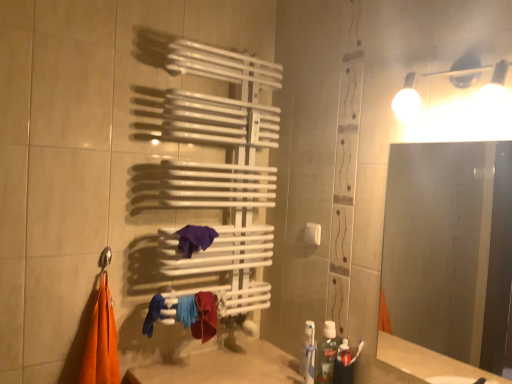
This screenshot has height=384, width=512. What do you see at coordinates (195, 238) in the screenshot?
I see `purple fabric towel at center` at bounding box center [195, 238].

This screenshot has width=512, height=384. What do you see at coordinates (313, 233) in the screenshot? I see `white plastic towel bar at center` at bounding box center [313, 233].

The height and width of the screenshot is (384, 512). What do you see at coordinates (326, 354) in the screenshot?
I see `translucent plastic toothpaste at lower right` at bounding box center [326, 354].

Where is `frosted glass mirror at right`? This screenshot has height=384, width=512. frosted glass mirror at right is located at coordinates (450, 248).

How different are the orientations of white plastic towel bar at center and frosted glass mirror at right in degrees?

They differ by 0.426 degrees in their facing directions.

Is white plastic towel bar at center positioned far away from frosted glass mirror at right?

Yes, white plastic towel bar at center is far from frosted glass mirror at right.

Who is taller, white plastic towel bar at center or frosted glass mirror at right?

Standing taller between the two is frosted glass mirror at right.

From a real-world perspective, which is physically below, white plastic towel bar at center or frosted glass mirror at right?

frosted glass mirror at right is physically lower.

Is blue fabric at lower center not close to translucent plastic toothpaste at lower right?

No, blue fabric at lower center is not far away from translucent plastic toothpaste at lower right.

Which is more to the right, blue fabric at lower center or translucent plastic toothpaste at lower right?

From the viewer's perspective, translucent plastic toothpaste at lower right appears more on the right side.

The width and height of the screenshot is (512, 384). What are the coordinates of `clothe in front of the translucent plastic toothpaste at lower right` in the screenshot? It's located at (153, 314).

Is blue fabric at lower center closer to camera compared to purple fabric towel at center?

No.

Can you confirm if blue fabric at lower center is smaller than purple fabric towel at center?

Yes.

Based on the photo, would you consider blue fabric at lower center to be distant from purple fabric towel at center?

No, blue fabric at lower center is in close proximity to purple fabric towel at center.

Is the surface of purple fabric towel at center in direct contact with white plastic towel bar at center?

There is a gap between purple fabric towel at center and white plastic towel bar at center.

Is point (189, 234) closer or farther from the camera than point (310, 224)?

Point (189, 234).

How much distance is there between purple fabric towel at center and white plastic towel bar at center?

purple fabric towel at center and white plastic towel bar at center are 16.60 inches apart from each other.

Considering the sizes of objects purple fabric towel at center and white plastic towel bar at center in the image provided, who is thinner, purple fabric towel at center or white plastic towel bar at center?

With smaller width is white plastic towel bar at center.

Considering the relative sizes of purple fabric towel at center and frosted glass mirror at right in the image provided, is purple fabric towel at center thinner than frosted glass mirror at right?

Incorrect, the width of purple fabric towel at center is not less than that of frosted glass mirror at right.

Considering the sizes of objects purple fabric towel at center and frosted glass mirror at right in the image provided, who is smaller, purple fabric towel at center or frosted glass mirror at right?

purple fabric towel at center.

In the scene shown: Is purple fabric towel at center placed right next to frosted glass mirror at right?

No.

Is purple fabric towel at center shorter than frosted glass mirror at right?

Correct, purple fabric towel at center is not as tall as frosted glass mirror at right.

From a real-world perspective, between frosted glass mirror at right and translucent plastic toothpaste at lower right, who is vertically higher?

frosted glass mirror at right, from a real-world perspective.

From the picture: What's the angular difference between frosted glass mirror at right and translucent plastic toothpaste at lower right's facing directions?

The facing directions of frosted glass mirror at right and translucent plastic toothpaste at lower right are 0.0535 degrees apart.

Who is smaller, frosted glass mirror at right or translucent plastic toothpaste at lower right?

Smaller between the two is translucent plastic toothpaste at lower right.

Can you confirm if frosted glass mirror at right is positioned to the right of translucent plastic toothpaste at lower right?

Correct, you'll find frosted glass mirror at right to the right of translucent plastic toothpaste at lower right.

Which is more to the right, translucent plastic toothpaste at lower right or white plastic towel bar at center?

Positioned to the right is translucent plastic toothpaste at lower right.

What's the angular difference between translucent plastic toothpaste at lower right and white plastic towel bar at center's facing directions?

The angular difference between translucent plastic toothpaste at lower right and white plastic towel bar at center is 0.373 degrees.

Is translucent plastic toothpaste at lower right next to white plastic towel bar at center and touching it?

translucent plastic toothpaste at lower right and white plastic towel bar at center are not in contact.

Looking at this image, which is correct: translucent plastic toothpaste at lower right is inside white plastic towel bar at center, or outside of it?

translucent plastic toothpaste at lower right is located beyond the bounds of white plastic towel bar at center.

Identify the location of mirror located underneath the white plastic towel bar at center (from a real-world perspective). The width and height of the screenshot is (512, 384). (450, 248).

The width and height of the screenshot is (512, 384). What are the coordinates of `clothe above the translucent plastic toothpaste at lower right (from the image's perspective)` in the screenshot? It's located at (153, 314).

From the image, which object appears to be nearer to translucent plastic toothpaste at lower right, white plastic towel bar at center or frosted glass mirror at right?

white plastic towel bar at center is positioned closer to the anchor translucent plastic toothpaste at lower right.

Consider the image. Which object lies further to the anchor point frosted glass mirror at right, blue fabric at lower center or translucent plastic toothpaste at lower right?

Among the two, blue fabric at lower center is located further to frosted glass mirror at right.

Looking at the image, which one is located closer to purple fabric towel at center, translucent plastic toothpaste at lower right or white plastic towel bar at center?

white plastic towel bar at center lies closer to purple fabric towel at center than the other object.

Estimate the real-world distances between objects in this image. Which object is further from translucent plastic toothpaste at lower right, frosted glass mirror at right or blue fabric at lower center?

Among the two, frosted glass mirror at right is located further to translucent plastic toothpaste at lower right.

From the image, which object appears to be farther from frosted glass mirror at right, translucent plastic toothpaste at lower right or purple fabric towel at center?

purple fabric towel at center.

When comparing their distances from white plastic towel bar at center, does blue fabric at lower center or purple fabric towel at center seem further?

blue fabric at lower center.

Looking at this image, considering their positions, is translucent plastic toothpaste at lower right positioned further to white plastic towel bar at center than purple fabric towel at center?

purple fabric towel at center is positioned further to the anchor white plastic towel bar at center.

When comparing their distances from translucent plastic toothpaste at lower right, does blue fabric at lower center or white plastic towel bar at center seem closer?

white plastic towel bar at center is positioned closer to the anchor translucent plastic toothpaste at lower right.

At what (x,y) coordinates should I click in order to perform the action: click on beach towel between blue fabric at lower center and white plastic towel bar at center in the horizontal direction. Please return your answer as a coordinate pair (x, y). This screenshot has height=384, width=512. Looking at the image, I should click on (195, 238).

This screenshot has height=384, width=512. In order to click on beach towel between blue fabric at lower center and frosted glass mirror at right in this screenshot , I will do pyautogui.click(x=195, y=238).

This screenshot has width=512, height=384. Identify the location of beach towel between blue fabric at lower center and translucent plastic toothpaste at lower right in the horizontal direction. (195, 238).

Image resolution: width=512 pixels, height=384 pixels. I want to click on bottle between blue fabric at lower center and frosted glass mirror at right, so click(x=326, y=354).